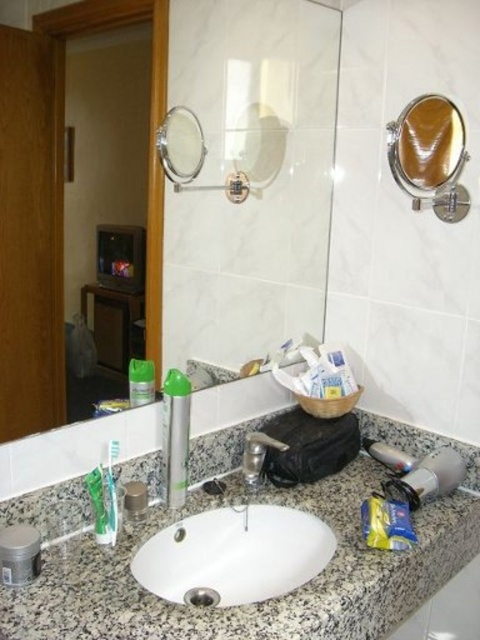
Question: Is white glossy sink at center positioned at the back of green matte toothpaste at lower left?

Choices:
 (A) no
 (B) yes

Answer: (A)

Question: Observing the image, what is the correct spatial positioning of matte black cabinet at left in reference to silver metallic magnifying mirror at upper left?

Choices:
 (A) below
 (B) above

Answer: (A)

Question: Which point appears closest to the camera in this image?

Choices:
 (A) coord(439,99)
 (B) coord(362,461)
 (C) coord(170,461)

Answer: (C)

Question: Estimate the real-world distances between objects in this image. Which object is closer to the matte silver mirror at upper center?

Choices:
 (A) satin gold mirror at upper right
 (B) green matte toothpaste at lower left
 (C) silver metallic magnifying mirror at upper left

Answer: (C)

Question: Is silver metallic magnifying mirror at upper left further to the viewer compared to satin nickel faucet at center?

Choices:
 (A) no
 (B) yes

Answer: (A)

Question: Which object is closer to the camera taking this photo?

Choices:
 (A) metallic silver canister at lower left
 (B) satin nickel faucet at center
 (C) satin gold mirror at upper right
 (D) matte silver mirror at upper center

Answer: (D)